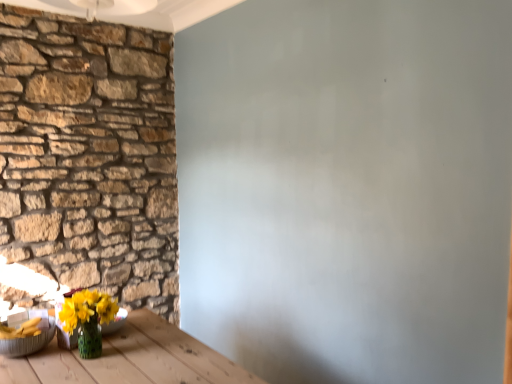
Question: Which is correct: natural stone wall at left is inside translucent glass vase at lower left, positioned as the 1th bowl in right-to-left order, or outside of it?

Choices:
 (A) inside
 (B) outside

Answer: (B)

Question: Is natural stone wall at left to the left or to the right of translucent glass vase at lower left, positioned as the 1th bowl in right-to-left order, in the image?

Choices:
 (A) right
 (B) left

Answer: (B)

Question: Which object is positioned closest to the metallic silver bowl at lower left, the first bowl from the left?

Choices:
 (A) translucent glass vase at lower left, positioned as the 1th bowl in right-to-left order
 (B) natural stone wall at left

Answer: (A)

Question: Considering the real-world distances, which object is closest to the translucent glass vase at lower left, which appears as the 2th bowl when viewed from the left?

Choices:
 (A) natural stone wall at left
 (B) metallic silver bowl at lower left, which is the second bowl in right-to-left order

Answer: (B)